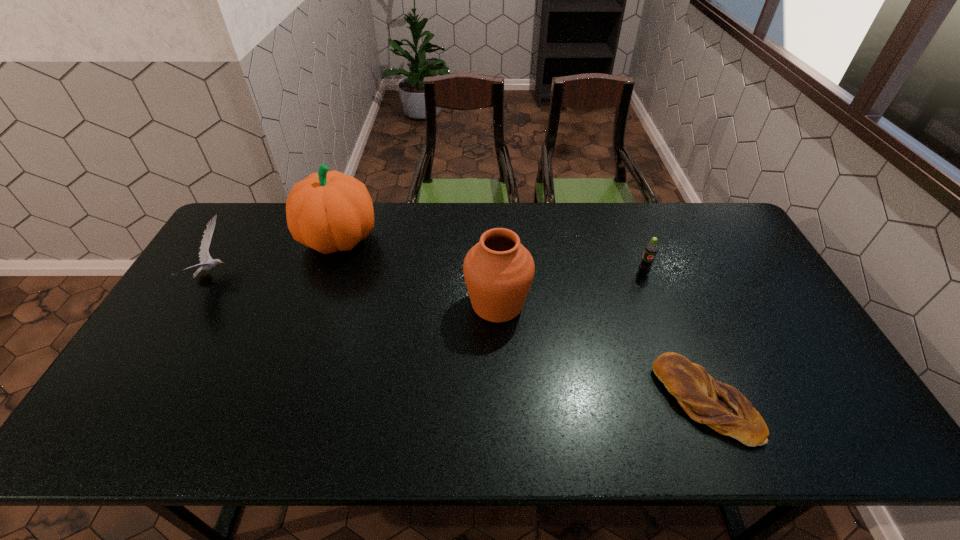
The height and width of the screenshot is (540, 960). I want to click on pumpkin, so 329,211.

The height and width of the screenshot is (540, 960). Find the location of `the fourth shortest object`. the fourth shortest object is located at coordinates (498, 271).

Identify the location of the third object from right to left. This screenshot has width=960, height=540. (498, 271).

Find the location of a particular element. This screenshot has height=540, width=960. gull is located at coordinates (x=204, y=255).

I want to click on soda, so click(x=644, y=268).

The height and width of the screenshot is (540, 960). Find the location of `the shortest object`. the shortest object is located at coordinates (722, 407).

Locate an element on the screen. the nearest object is located at coordinates (722, 407).

You are a GUI agent. You are given a task and a screenshot of the screen. Output one action in this format:
    pyautogui.click(x=<x>, y=<y>)
    Task: Click on the blank space located 0.140m on the right of the pumpkin
    Image resolution: width=960 pixels, height=540 pixels.
    Given the screenshot: What is the action you would take?
    pyautogui.click(x=420, y=239)

Where is `vacant space located on the back of the fourth shortest object`? The width and height of the screenshot is (960, 540). vacant space located on the back of the fourth shortest object is located at coordinates (495, 243).

Identify the location of blank space located 0.330m at the tip of the beak of the gull. Image resolution: width=960 pixels, height=540 pixels. (337, 276).